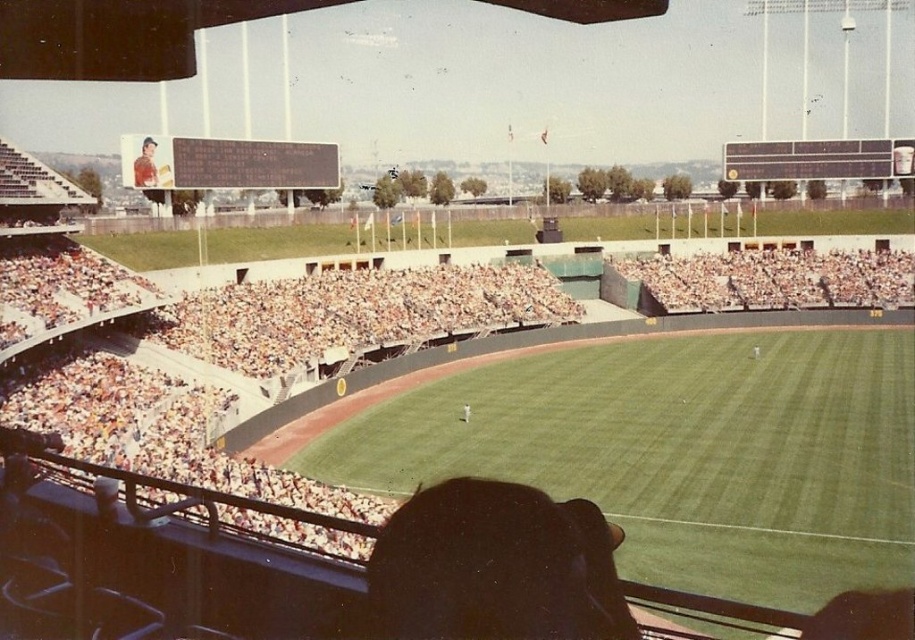
Question: Does brown leather jacket at upper left have a smaller size compared to white uniform person at center?

Choices:
 (A) no
 (B) yes

Answer: (B)

Question: Does brown leather jacket at upper left have a lesser width compared to white uniform person at center?

Choices:
 (A) no
 (B) yes

Answer: (B)

Question: Is brown leather jacket at upper left closer to camera compared to white uniform person at center?

Choices:
 (A) yes
 (B) no

Answer: (B)

Question: Which of the following is the farthest from the observer?

Choices:
 (A) brown leather jacket at upper left
 (B) white uniform person at center

Answer: (A)

Question: Among these objects, which one is nearest to the camera?

Choices:
 (A) white uniform person at center
 (B) brown leather jacket at upper left

Answer: (A)

Question: Among these points, which one is nearest to the camera?

Choices:
 (A) (138, 179)
 (B) (467, 408)

Answer: (B)